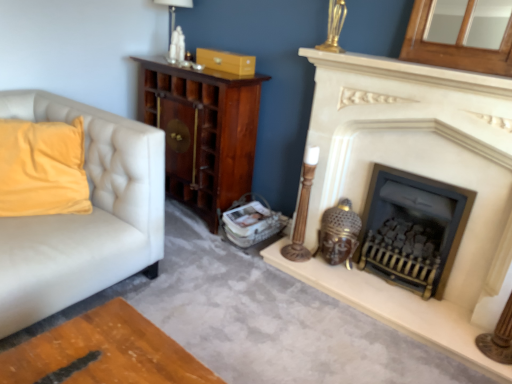
Question: Does point (424, 243) appear closer or farther from the camera than point (218, 56)?

Choices:
 (A) farther
 (B) closer

Answer: (B)

Question: From a real-world perspective, is black cast iron wood burning stove at center positioned above or below matte wood drawer at upper center?

Choices:
 (A) above
 (B) below

Answer: (B)

Question: Considering the real-world distances, which object is closest to the white glossy table lamp at upper center?

Choices:
 (A) matte white fireplace at right
 (B) matte wood drawer at upper center
 (C) black cast iron wood burning stove at center
 (D) velvet yellow pillow at left
 (E) dark wood cabinet at center

Answer: (B)

Question: Which of these objects is positioned closest to the black cast iron wood burning stove at center?

Choices:
 (A) white glossy table lamp at upper center
 (B) velvet yellow pillow at left
 (C) dark wood cabinet at center
 (D) matte wood drawer at upper center
 (E) matte white fireplace at right

Answer: (E)